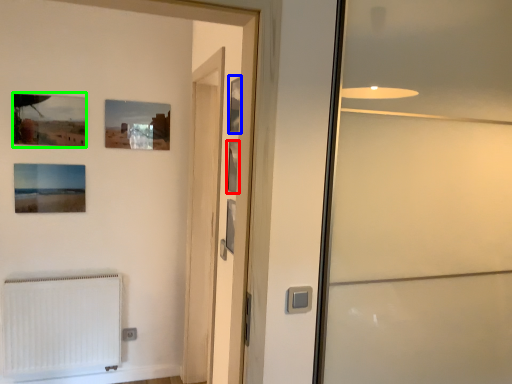
Question: Based on their relative distances, which object is farther from picture frame (highlighted by a red box)? Choose from picture frame (highlighted by a blue box) and picture frame (highlighted by a green box).

Choices:
 (A) picture frame
 (B) picture frame

Answer: (B)